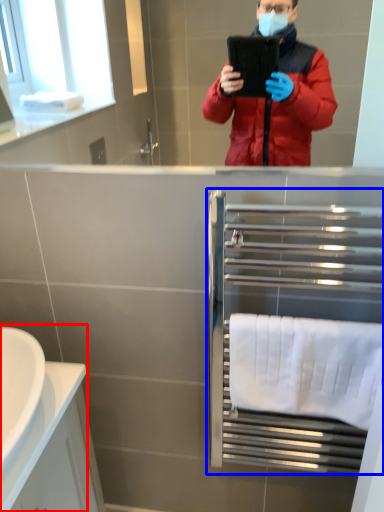
Question: Which object is further to the camera taking this photo, sink (highlighted by a red box) or balustrade (highlighted by a blue box)?

Choices:
 (A) sink
 (B) balustrade

Answer: (B)